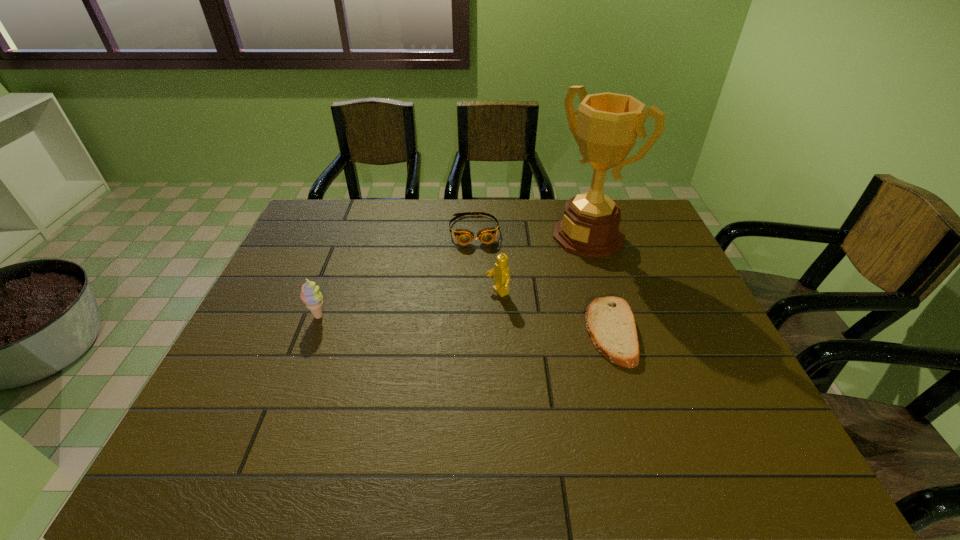
You are a GUI agent. You are given a task and a screenshot of the screen. Output one action in this format:
    pyautogui.click(x=<x>, y=<y>)
    Task: Click on the free point between the leftmost object and the goggles
    Image resolution: width=960 pixels, height=540 pixels.
    Given the screenshot: What is the action you would take?
    pyautogui.click(x=396, y=274)

The width and height of the screenshot is (960, 540). I want to click on vacant area that lies between the Lego and the award, so click(x=542, y=265).

I want to click on vacant space that's between the leftmost object and the tallest object, so click(x=453, y=276).

Where is `vacant space that is in between the shortest object and the Lego`? Image resolution: width=960 pixels, height=540 pixels. vacant space that is in between the shortest object and the Lego is located at coordinates (554, 312).

Where is `free space between the award and the pita bread`? The height and width of the screenshot is (540, 960). free space between the award and the pita bread is located at coordinates (599, 284).

You are a GUI agent. You are given a task and a screenshot of the screen. Output one action in this format:
    pyautogui.click(x=<x>, y=<y>)
    Task: Click on the free space between the tallest object and the goggles
    This screenshot has height=540, width=960.
    Given the screenshot: What is the action you would take?
    pyautogui.click(x=531, y=233)

I want to click on the fourth closest object relative to the award, so click(310, 295).

Locate an element on the screen. The image size is (960, 540). object that can be found as the fourth closest to the goggles is located at coordinates (310, 295).

Identify the location of vacant region that satisfies the following two spatial constraints: 1. on the front side of the fourth tallest object; 2. on the right side of the award. This screenshot has width=960, height=540. (474, 236).

Locate an element on the screen. This screenshot has width=960, height=540. vacant space that satisfies the following two spatial constraints: 1. on the back side of the tallest object; 2. on the right side of the sherbert is located at coordinates tap(349, 236).